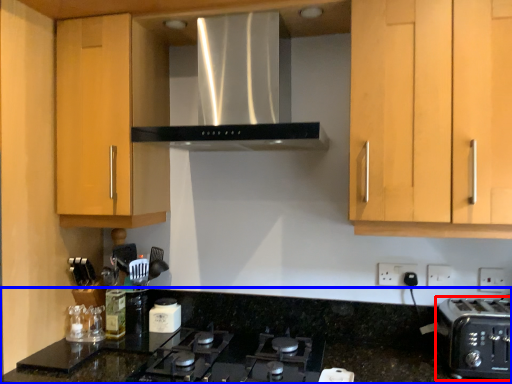
Question: Which object appears farthest to the camera in this image, toaster (highlighted by a red box) or countertop (highlighted by a blue box)?

Choices:
 (A) toaster
 (B) countertop

Answer: (A)